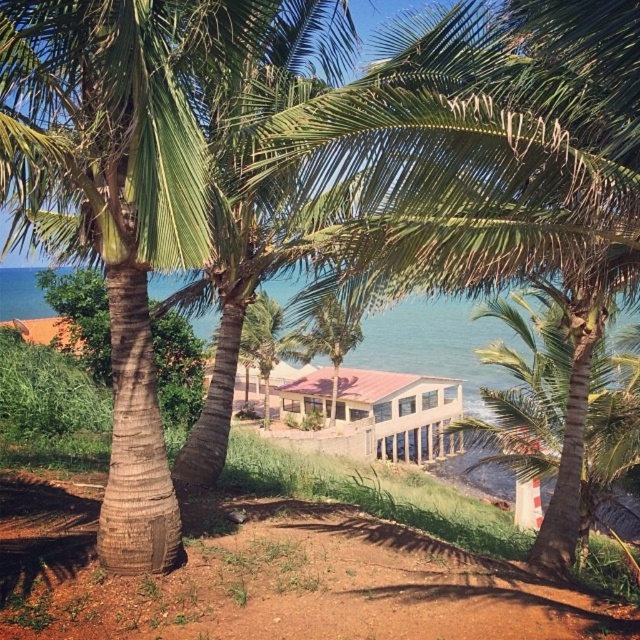
Question: Which point is closer to the camera?

Choices:
 (A) green leafy palm tree at center
 (B) pink corrugated metal hut at center

Answer: (A)

Question: Which object appears closest to the camera in this image?

Choices:
 (A) pink corrugated metal hut at center
 (B) green leafy palm tree at center

Answer: (B)

Question: Does green leafy palm tree at center have a larger size compared to pink corrugated metal hut at center?

Choices:
 (A) no
 (B) yes

Answer: (B)

Question: Considering the relative positions of green leafy palm tree at center and pink corrugated metal hut at center in the image provided, where is green leafy palm tree at center located with respect to pink corrugated metal hut at center?

Choices:
 (A) right
 (B) left

Answer: (A)

Question: Where is green leafy palm tree at center located in relation to pink corrugated metal hut at center in the image?

Choices:
 (A) left
 (B) right

Answer: (B)